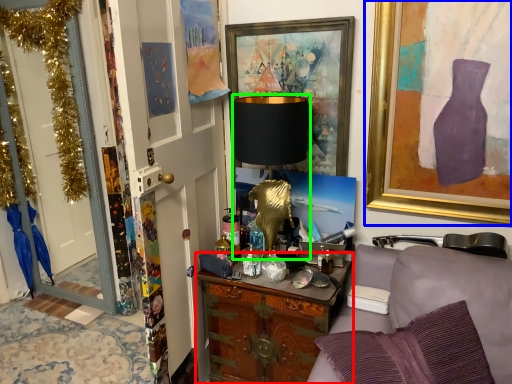
Question: Considering the real-world distances, which object is farthest from cabinetry (highlighted by a red box)? picture frame (highlighted by a blue box) or table lamp (highlighted by a green box)?

Choices:
 (A) picture frame
 (B) table lamp

Answer: (A)